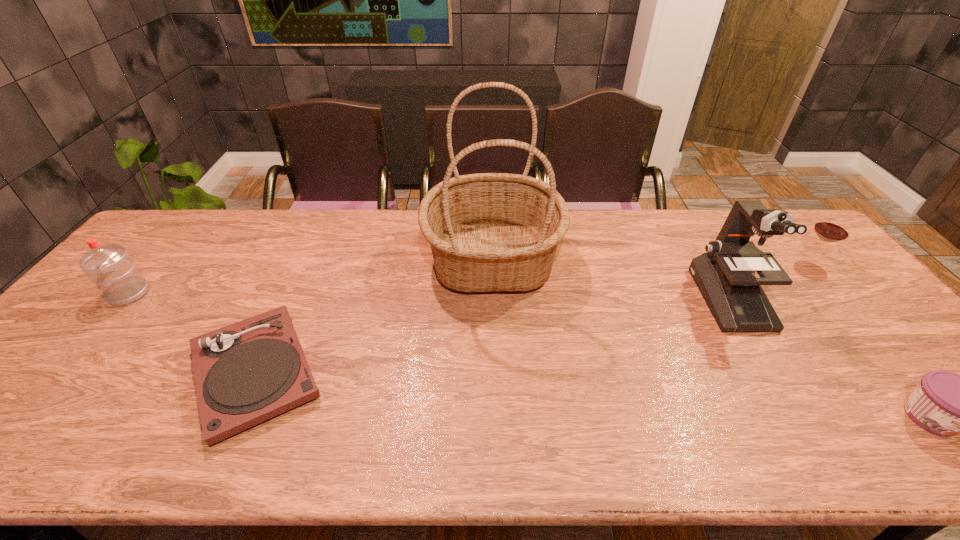
In order to click on the fourth object from right to left in this screenshot , I will do `click(488, 232)`.

This screenshot has height=540, width=960. What are the coordinates of `basket` in the screenshot? It's located at (488, 232).

Image resolution: width=960 pixels, height=540 pixels. I want to click on the fourth object from left to right, so click(725, 274).

This screenshot has width=960, height=540. Find the location of `microscope`. microscope is located at coordinates (725, 274).

What are the coordinates of `the leftmost object` in the screenshot? It's located at point(116,275).

You are a GUI agent. You are given a task and a screenshot of the screen. Output one action in this format:
    pyautogui.click(x=<x>, y=<y>)
    Task: Click on the water bottle
    
    Given the screenshot: What is the action you would take?
    pyautogui.click(x=116, y=275)

At what (x,y) coordinates should I click in order to perform the action: click on wineglass. Please return your answer as a coordinate pair (x, y). Looking at the image, I should click on (830, 228).

Locate an element on the screen. The width and height of the screenshot is (960, 540). the shortest object is located at coordinates (250, 371).

Locate an element on the screen. phonograph_record is located at coordinates (250, 371).

This screenshot has height=540, width=960. Find the location of `free space located on the back of the basket`. free space located on the back of the basket is located at coordinates (491, 211).